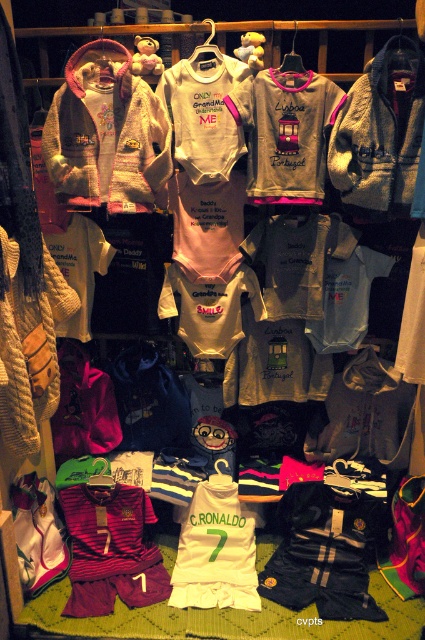
You are a parent shopping for a baby outfit. You see the bright maroon jersey at center and the white jersey at center. Which one is located below the other?

The bright maroon jersey at center is positioned under the white jersey at center, so it is located below the white jersey at center.

You are a parent looking to buy a baby onesie for your child. You see the bright maroon jersey at center and the white jersey at center. Which one is located to the left?

The bright maroon jersey at center is positioned on the left side of white jersey at center, so the bright maroon jersey at center is located to the left.